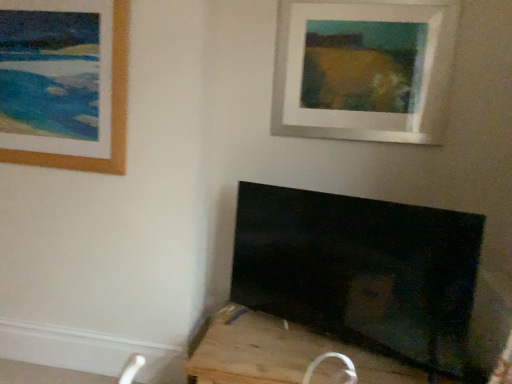
Question: Is wooden frame at upper left, the 2th picture frame in the right-to-left sequence, not near black matte tv at lower right?

Choices:
 (A) no
 (B) yes

Answer: (B)

Question: Is wooden frame at upper left, the 2th picture frame in the right-to-left sequence, bigger than black matte tv at lower right?

Choices:
 (A) yes
 (B) no

Answer: (B)

Question: Considering the relative sizes of wooden frame at upper left, the first picture frame viewed from the left, and black matte tv at lower right in the image provided, is wooden frame at upper left, the first picture frame viewed from the left, shorter than black matte tv at lower right?

Choices:
 (A) yes
 (B) no

Answer: (B)

Question: Is black matte tv at lower right surrounded by wooden frame at upper left, the 2th picture frame in the right-to-left sequence?

Choices:
 (A) no
 (B) yes

Answer: (A)

Question: Is wooden frame at upper left, the 2th picture frame in the right-to-left sequence, completely or partially outside of black matte tv at lower right?

Choices:
 (A) no
 (B) yes

Answer: (B)

Question: From a real-world perspective, is wooden frame at upper left, the 2th picture frame in the right-to-left sequence, beneath black matte tv at lower right?

Choices:
 (A) no
 (B) yes

Answer: (A)

Question: Is white matte picture frame at upper center, the second picture frame when ordered from left to right, surrounded by wooden frame at upper left, the 2th picture frame in the right-to-left sequence?

Choices:
 (A) no
 (B) yes

Answer: (A)

Question: From a real-world perspective, does wooden frame at upper left, the first picture frame viewed from the left, stand above white matte picture frame at upper center, the first picture frame when ordered from right to left?

Choices:
 (A) yes
 (B) no

Answer: (B)

Question: From a real-world perspective, is wooden frame at upper left, the first picture frame viewed from the left, positioned under white matte picture frame at upper center, the first picture frame when ordered from right to left, based on gravity?

Choices:
 (A) yes
 (B) no

Answer: (A)

Question: Can you confirm if wooden frame at upper left, the first picture frame viewed from the left, is shorter than white matte picture frame at upper center, the first picture frame when ordered from right to left?

Choices:
 (A) yes
 (B) no

Answer: (B)

Question: Is wooden frame at upper left, the first picture frame viewed from the left, next to white matte picture frame at upper center, the first picture frame when ordered from right to left, and touching it?

Choices:
 (A) yes
 (B) no

Answer: (B)

Question: Considering the relative sizes of wooden frame at upper left, the first picture frame viewed from the left, and white matte picture frame at upper center, the second picture frame when ordered from left to right, in the image provided, is wooden frame at upper left, the first picture frame viewed from the left, wider than white matte picture frame at upper center, the second picture frame when ordered from left to right,?

Choices:
 (A) yes
 (B) no

Answer: (B)

Question: Is black matte tv at lower right to the right of wooden frame at upper left, the first picture frame viewed from the left, from the viewer's perspective?

Choices:
 (A) no
 (B) yes

Answer: (B)